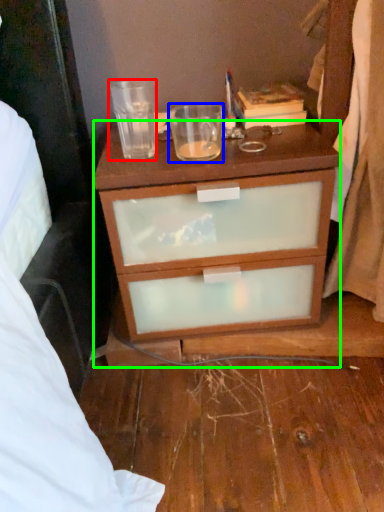
Question: Based on their relative distances, which object is nearer to coffee cup (highlighted by a red box)? Choose from coffee cup (highlighted by a blue box) and desk (highlighted by a green box).

Choices:
 (A) coffee cup
 (B) desk

Answer: (A)